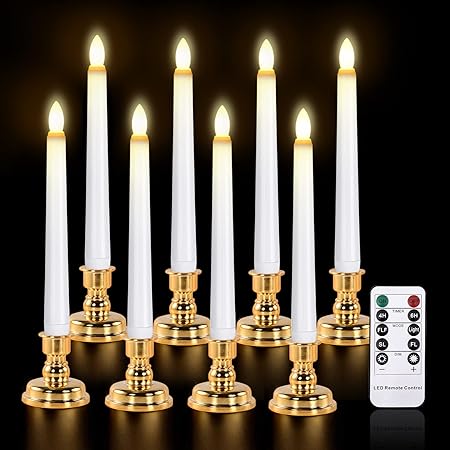
Find the location of a particular element. The width and height of the screenshot is (450, 450). candle stand is located at coordinates (97, 317), (57, 382), (119, 389), (181, 313), (211, 373), (254, 303), (297, 377), (348, 316).